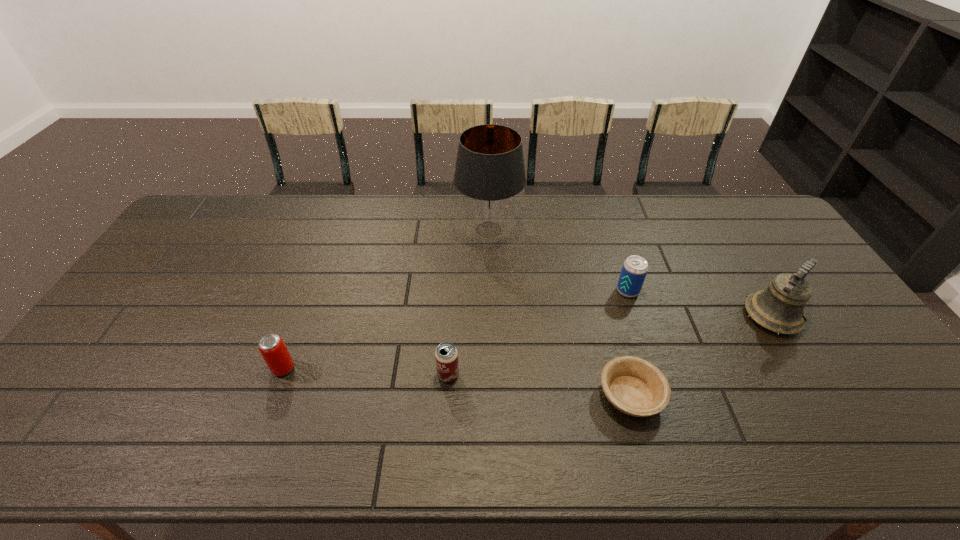
This screenshot has height=540, width=960. I want to click on the farthest object, so pyautogui.click(x=489, y=172).

Image resolution: width=960 pixels, height=540 pixels. In order to click on the tallest object in this screenshot , I will do `click(489, 172)`.

In order to click on bell in this screenshot , I will do `click(780, 308)`.

Locate an element on the screen. This screenshot has width=960, height=540. the fifth shortest object is located at coordinates (780, 308).

What are the coordinates of `the rightmost beer can` in the screenshot? It's located at point(634,270).

This screenshot has width=960, height=540. Find the location of `the leftmost beer can`. the leftmost beer can is located at coordinates [x=271, y=346].

The width and height of the screenshot is (960, 540). Identify the location of the second beer can from right to left. (446, 355).

Where is `bowl`? bowl is located at coordinates (635, 386).

Where is `vacant region located 0.220m on the right of the lampshade`? The width and height of the screenshot is (960, 540). vacant region located 0.220m on the right of the lampshade is located at coordinates (586, 230).

Locate an element on the screen. This screenshot has width=960, height=540. vacant area situated on the front of the rightmost object is located at coordinates (825, 401).